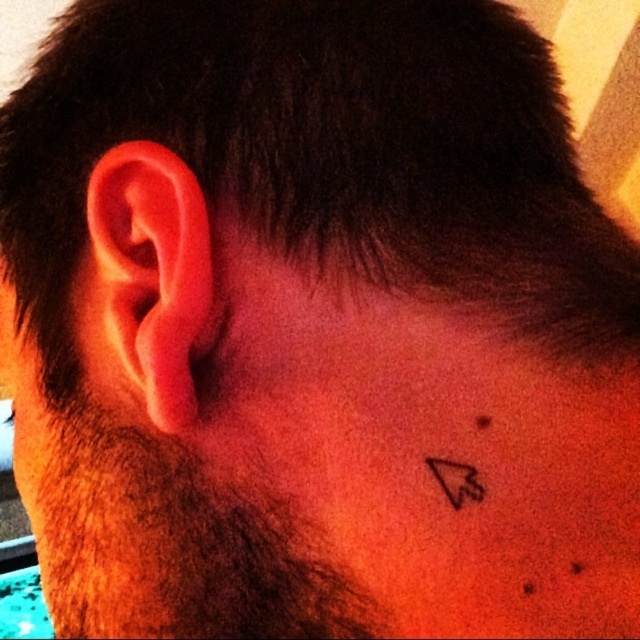
You are a photographer adjusting your camera to focus on two points in the image. The first point is at coordinates point (156, 253) and the second is at point (461, 470). Which point should you focus on first if you want to start with the one closer to the camera?

Point (156, 253) is closer to the viewer than point (461, 470), so you should focus on point (156, 253) first.